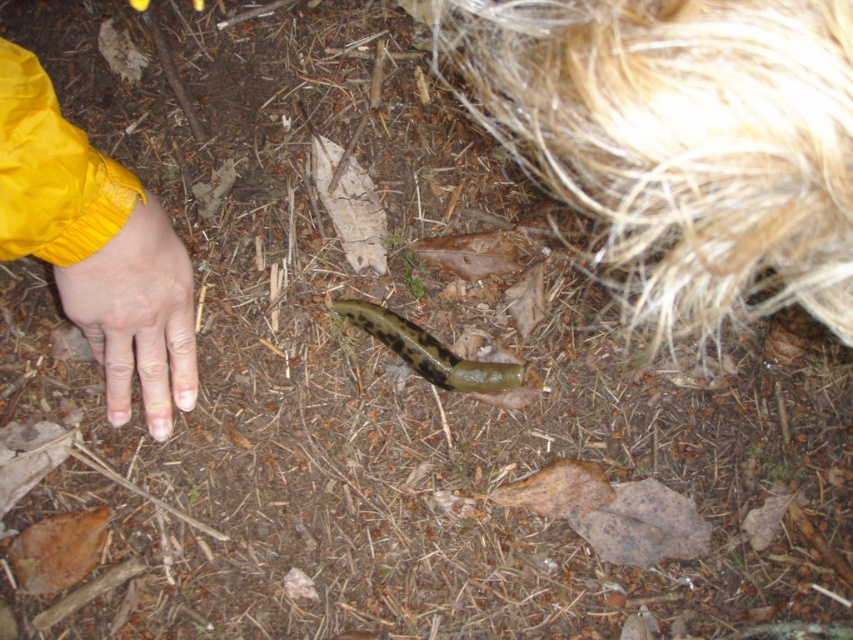
Can you confirm if yellow fabric hand at lower left is positioned below green slimy slug at center?

Actually, yellow fabric hand at lower left is above green slimy slug at center.

Can you confirm if yellow fabric hand at lower left is bigger than green slimy slug at center?

Yes, yellow fabric hand at lower left is bigger than green slimy slug at center.

Is point (100, 362) in front of point (445, 353)?

That is True.

You are a GUI agent. You are given a task and a screenshot of the screen. Output one action in this format:
    pyautogui.click(x=<x>, y=<y>)
    Task: Click on the yellow fabric hand at lower left
    The width and height of the screenshot is (853, 640).
    Given the screenshot: What is the action you would take?
    pyautogui.click(x=96, y=244)

Does yellow matte hand at lower left come in front of green slimy slug at center?

Answer: Yes, it is in front of green slimy slug at center.

Based on the photo, does yellow matte hand at lower left appear over green slimy slug at center?

Yes, yellow matte hand at lower left is above green slimy slug at center.

The height and width of the screenshot is (640, 853). I want to click on yellow matte hand at lower left, so click(137, 316).

Measure the distance from yellow fabric hand at lower left to yellow matte hand at lower left.

0.74 inches

Who is lower down, yellow fabric hand at lower left or yellow matte hand at lower left?

Positioned lower is yellow matte hand at lower left.

The image size is (853, 640). I want to click on yellow fabric hand at lower left, so click(x=96, y=244).